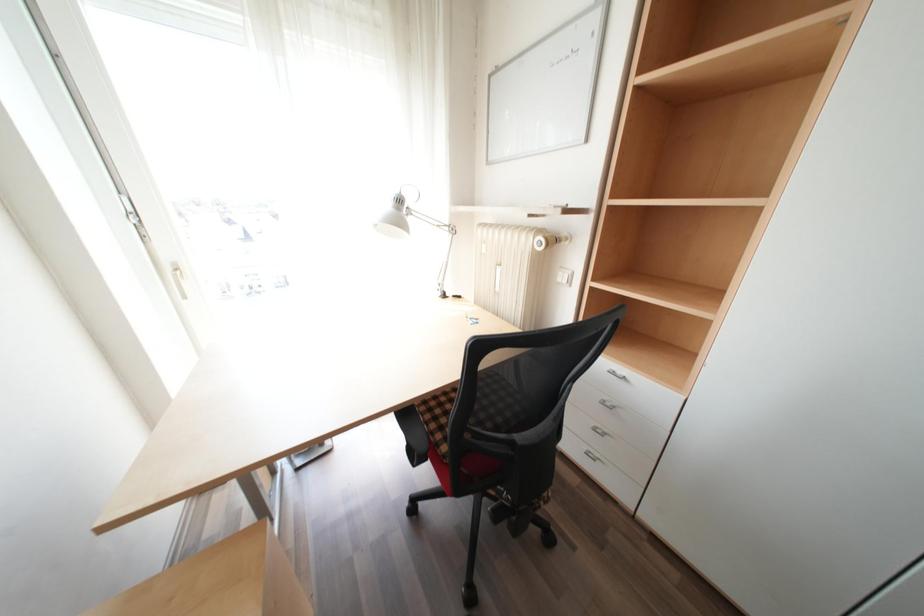
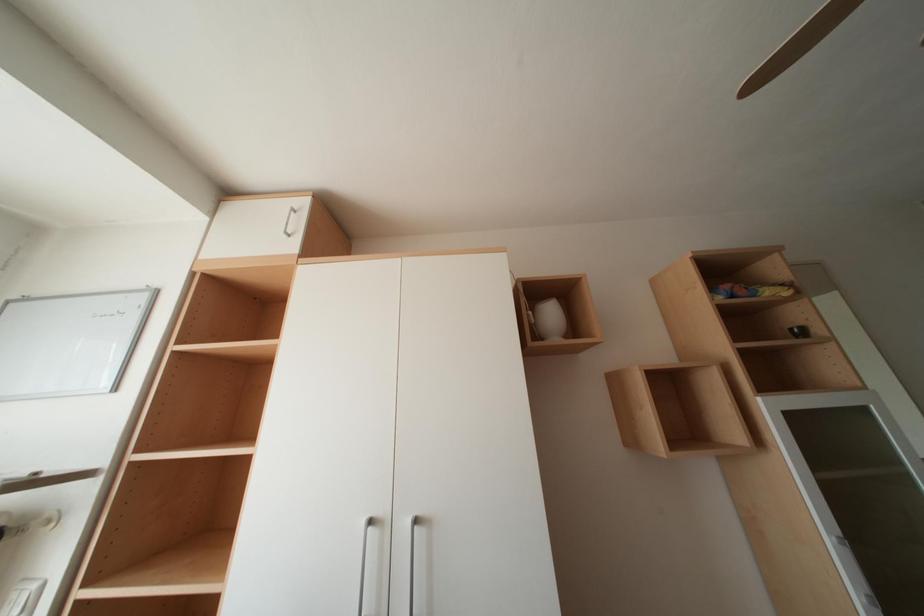
Based on the continuous images, in which direction is the camera rotating?

The camera rotated toward right-up.